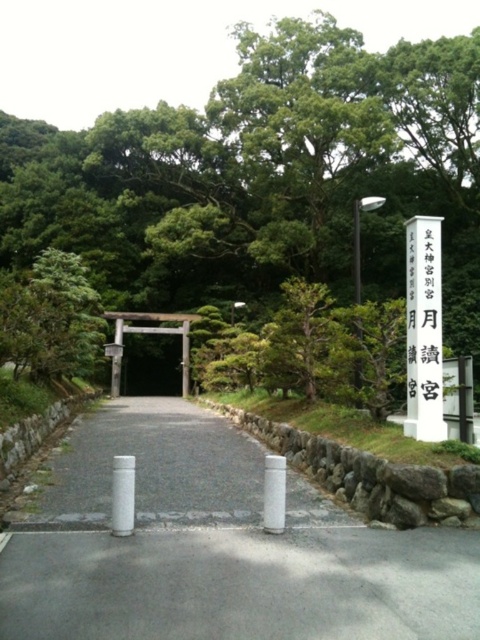
Question: Which of the following is the farthest from the observer?

Choices:
 (A) (228, 465)
 (B) (262, 84)
 (C) (131, 508)
 (D) (425, 410)

Answer: (B)

Question: Is black stone sign at right bigger than white smooth pillar at center?

Choices:
 (A) yes
 (B) no

Answer: (A)

Question: Which of the following is the closest to the observer?

Choices:
 (A) (47, 224)
 (B) (133, 355)
 (C) (119, 419)

Answer: (C)

Question: Does green leafy tree at center lie in front of black stone sign at right?

Choices:
 (A) yes
 (B) no

Answer: (B)

Question: Can you confirm if wooden torii gate at center is thinner than white smooth pillar at center?

Choices:
 (A) no
 (B) yes

Answer: (A)

Question: Which object is farther from the camera taking this photo?

Choices:
 (A) gray asphalt path at center
 (B) wooden torii gate at center
 (C) green leafy tree at center
 (D) white smooth pillar at center

Answer: (B)